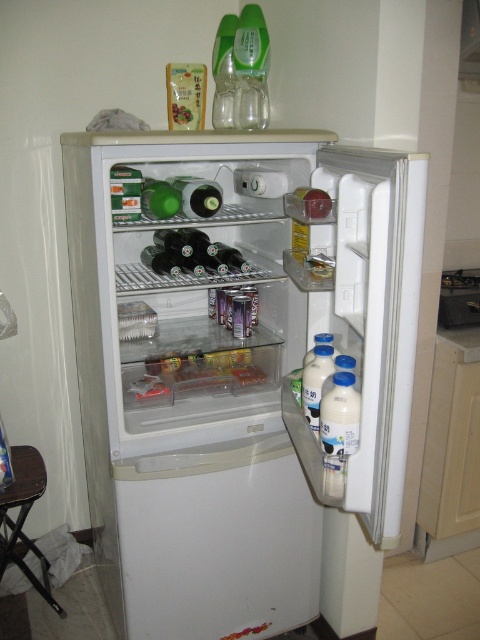
Does brown wood stool at lower left have a smaller size compared to green glass bottle at center?

No, brown wood stool at lower left is not smaller than green glass bottle at center.

Is brown wood stool at lower left to the right of green glass bottle at center from the viewer's perspective?

Incorrect, brown wood stool at lower left is not on the right side of green glass bottle at center.

Is point (0, 492) in front of point (219, 204)?

That is False.

Identify the location of brown wood stool at lower left. The height and width of the screenshot is (640, 480). (24, 516).

Can you confirm if white plastic fridge at center is smaller than brown wood stool at lower left?

Incorrect, white plastic fridge at center is not smaller in size than brown wood stool at lower left.

Which is behind, point (182, 376) or point (19, 528)?

Positioned behind is point (19, 528).

Does point (416, 304) come closer to viewer compared to point (21, 531)?

Yes, point (416, 304) is closer to viewer.

Image resolution: width=480 pixels, height=640 pixels. Find the location of `white plastic fridge at center`. white plastic fridge at center is located at coordinates [x=237, y=365].

Between white plastic fridge at center and green glass bottle at center, which one is positioned lower?

Positioned lower is white plastic fridge at center.

Is white plastic fridge at center below green glass bottle at center?

Indeed, white plastic fridge at center is positioned under green glass bottle at center.

Describe the element at coordinates (237, 365) in the screenshot. I see `white plastic fridge at center` at that location.

Identify the location of white plastic fridge at center. The height and width of the screenshot is (640, 480). (237, 365).